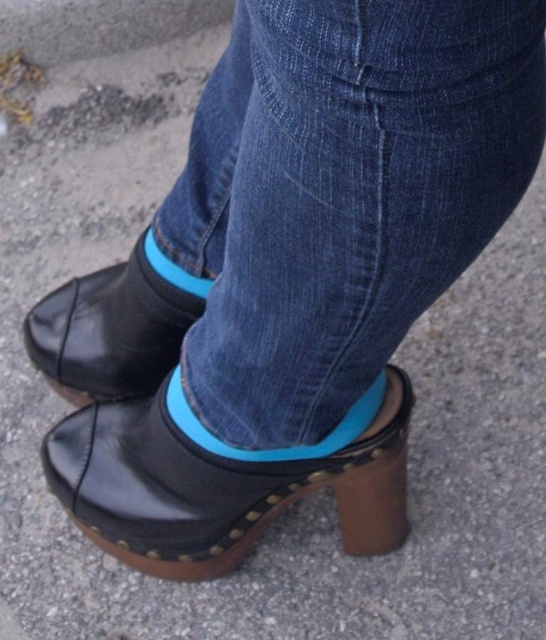
What is the 2D coordinate of the denim at center in the image?

The denim at center is located at the 2D coordinate point of (342, 193).